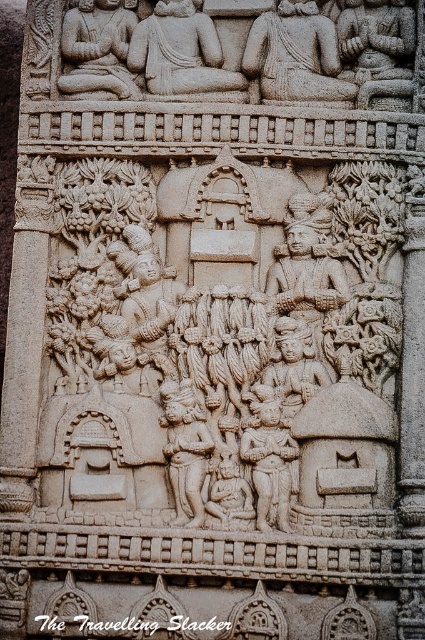
You are an art conservator examining the stone carving. You notice two figures of interest, the smooth stone figure at upper center and the carved stone figure at center. Which figure is closer to you as you stand in front of the carving?

The smooth stone figure at upper center is closer to you because it is further to the viewer than the carved stone figure at center.

Looking at the ancient stone carving, there are two central figures labeled as carved stone figures at center and smooth stone figure at center. Which one is positioned to the left?

The carved stone figures at center is to the left of smooth stone figure at center.

Looking at the ancient stone carving, you notice two figures of interest. The smooth stone figure at upper center and the carved stone figure at center. Which of these two figures is larger in size?

The carved stone figure at center is larger than the smooth stone figure at upper center.